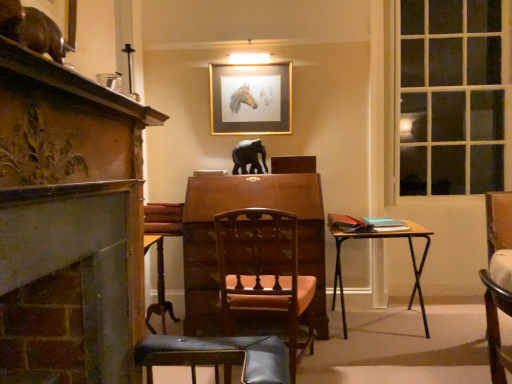
Question: Is wooden chair at right, which is the third chair from left to right, shorter than wooden table at right?

Choices:
 (A) no
 (B) yes

Answer: (A)

Question: Is wooden chair at right, which is the third chair from left to right, oriented away from wooden table at right?

Choices:
 (A) no
 (B) yes

Answer: (A)

Question: Considering the relative sizes of wooden chair at right, which is the third chair from left to right, and wooden table at right in the image provided, is wooden chair at right, which is the third chair from left to right, smaller than wooden table at right?

Choices:
 (A) yes
 (B) no

Answer: (A)

Question: From the image's perspective, is wooden chair at right, which is the third chair from left to right, under wooden table at right?

Choices:
 (A) yes
 (B) no

Answer: (B)

Question: Is wooden chair at right, which is the third chair from left to right, wider than wooden table at right?

Choices:
 (A) no
 (B) yes

Answer: (A)

Question: Is wooden table at right a part of wooden chair at right, marked as the 1th chair in a right-to-left arrangement?

Choices:
 (A) no
 (B) yes

Answer: (A)

Question: Is clear glass window at right located outside shiny brown cat at upper left, which is counted as the second animal, starting from the right?

Choices:
 (A) no
 (B) yes

Answer: (B)

Question: Does clear glass window at right have a larger size compared to shiny brown cat at upper left, placed as the 2th animal when sorted from back to front?

Choices:
 (A) no
 (B) yes

Answer: (B)

Question: Considering the relative sizes of clear glass window at right and shiny brown cat at upper left, which is counted as the second animal, starting from the right, in the image provided, is clear glass window at right smaller than shiny brown cat at upper left, which is counted as the second animal, starting from the right,?

Choices:
 (A) no
 (B) yes

Answer: (A)

Question: Does clear glass window at right lie in front of shiny brown cat at upper left, the first animal in the front-to-back sequence?

Choices:
 (A) no
 (B) yes

Answer: (A)

Question: From the image's perspective, is clear glass window at right above shiny brown cat at upper left, the first animal in the front-to-back sequence?

Choices:
 (A) no
 (B) yes

Answer: (A)

Question: Considering the relative positions of clear glass window at right and shiny brown cat at upper left, which is counted as the second animal, starting from the right, in the image provided, is clear glass window at right to the left of shiny brown cat at upper left, which is counted as the second animal, starting from the right, from the viewer's perspective?

Choices:
 (A) no
 (B) yes

Answer: (A)

Question: Considering the relative sizes of gold metallic picture frame at upper center and carved wood fireplace at left in the image provided, is gold metallic picture frame at upper center smaller than carved wood fireplace at left?

Choices:
 (A) yes
 (B) no

Answer: (A)